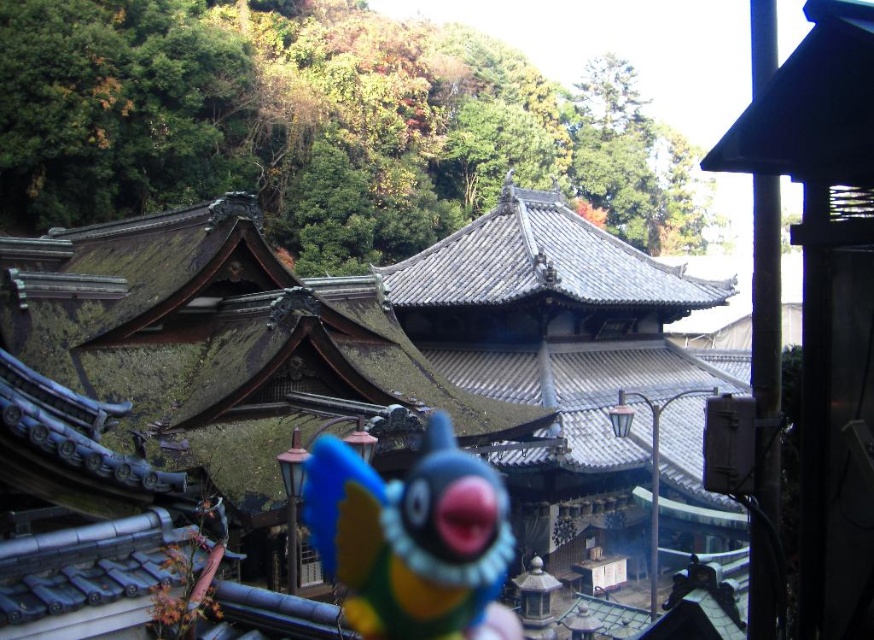
Question: Does rusty metal roof at center appear over plush blue bird at center?

Choices:
 (A) yes
 (B) no

Answer: (A)

Question: Observing the image, what is the correct spatial positioning of rusty metal roof at center in reference to plush blue bird at center?

Choices:
 (A) above
 (B) below

Answer: (A)

Question: Is rusty metal roof at center to the right of plush blue bird at center from the viewer's perspective?

Choices:
 (A) yes
 (B) no

Answer: (B)

Question: Which of the following is the closest to the observer?

Choices:
 (A) (389, 513)
 (B) (26, 280)

Answer: (B)

Question: Which point is farther to the camera?

Choices:
 (A) (500, 508)
 (B) (125, 532)

Answer: (A)